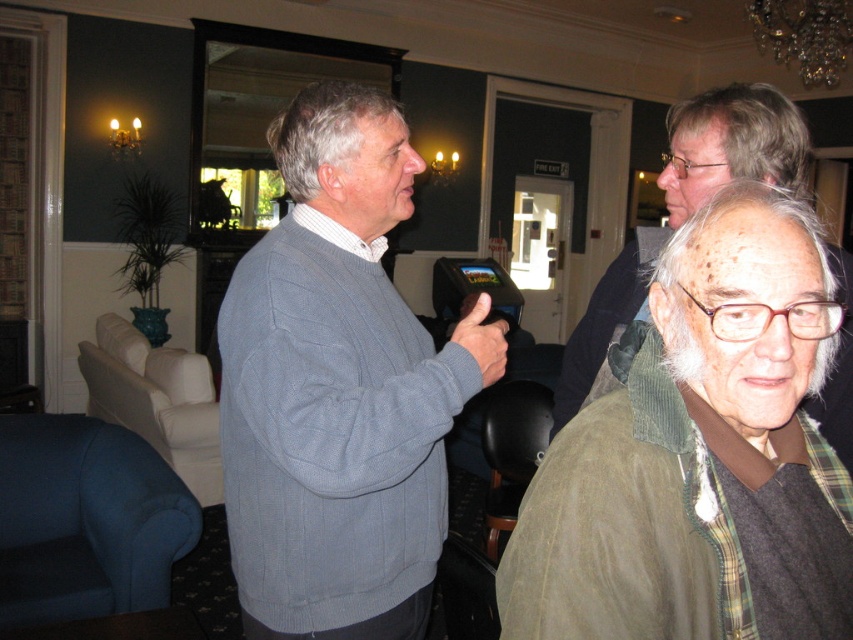
You are standing in the room and want to sit in the black leather armchair at lower center. Which direction should you move relative to the dark brown leather armchair at lower center?

The black leather armchair at lower center is to the right of the dark brown leather armchair at lower center. Therefore, you should move to the right side of the dark brown leather armchair at lower center to sit in the black leather armchair at lower center.

Based on the photo, you are standing in the room and want to hand a document to the person wearing the green corduroy jacket at center. The document is currently on the dark brown leather armchair at lower center. Can you reach the document without moving the armchair?

The green corduroy jacket at center is positioned on the right side of dark brown leather armchair at lower center, so the person wearing the jacket is near the armchair. You can reach the document on the dark brown leather armchair at lower center by extending your arm towards the right side where the jacket is located.

You are standing in the room and want to locate the green corduroy jacket at center. Which object is the point at coordinate (699, 454) on?

The point at coordinate (699, 454) is on the green corduroy jacket at center.